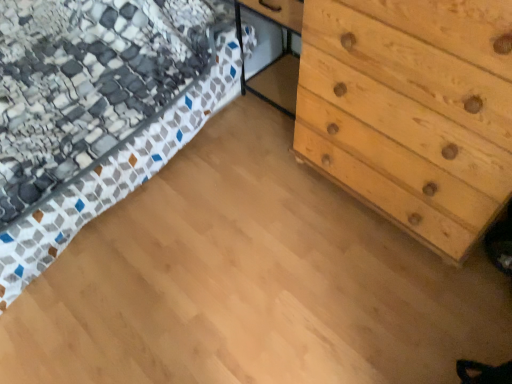
At what (x,y) coordinates should I click in order to perform the action: click on patterned fabric bed at upper left. Please return your answer as a coordinate pair (x, y). This screenshot has width=512, height=384. Looking at the image, I should click on (105, 104).

What do you see at coordinates (105, 104) in the screenshot? I see `patterned fabric bed at upper left` at bounding box center [105, 104].

Image resolution: width=512 pixels, height=384 pixels. What do you see at coordinates (401, 122) in the screenshot?
I see `natural wood chest of drawers at right` at bounding box center [401, 122].

Find the location of a particular element. The width and height of the screenshot is (512, 384). natural wood chest of drawers at right is located at coordinates (401, 122).

In order to face natural wood chest of drawers at right, should I rotate leftwards or rightwards?

You should look right and rotate roughly 22.495 degrees.

The width and height of the screenshot is (512, 384). Find the location of `patterned fabric bed at upper left`. patterned fabric bed at upper left is located at coordinates (105, 104).

Considering the relative positions of patterned fabric bed at upper left and natural wood chest of drawers at right in the image provided, is patterned fabric bed at upper left to the left or to the right of natural wood chest of drawers at right?

Based on their positions, patterned fabric bed at upper left is located to the left of natural wood chest of drawers at right.

Consider the image. Is patterned fabric bed at upper left behind natural wood chest of drawers at right?

Yes, it is.

Does point (205, 112) come in front of point (357, 79)?

No, (205, 112) is behind (357, 79).

From the image's perspective, is patterned fabric bed at upper left over natural wood chest of drawers at right?

Yes, from the image's perspective, patterned fabric bed at upper left is over natural wood chest of drawers at right.

From a real-world perspective, who is located lower, patterned fabric bed at upper left or natural wood chest of drawers at right?

patterned fabric bed at upper left, from a real-world perspective.

Can you confirm if patterned fabric bed at upper left is wider than natural wood chest of drawers at right?

Yes.

Between patterned fabric bed at upper left and natural wood chest of drawers at right, which one has more height?

natural wood chest of drawers at right is taller.

Which of these two, patterned fabric bed at upper left or natural wood chest of drawers at right, is smaller?

natural wood chest of drawers at right is smaller.

Which is correct: patterned fabric bed at upper left is inside natural wood chest of drawers at right, or outside of it?

patterned fabric bed at upper left is outside natural wood chest of drawers at right.

Would you say patterned fabric bed at upper left is a long distance from natural wood chest of drawers at right?

No, patterned fabric bed at upper left is in close proximity to natural wood chest of drawers at right.

Is patterned fabric bed at upper left oriented away from natural wood chest of drawers at right?

That's not correct — patterned fabric bed at upper left is not looking away from natural wood chest of drawers at right.

The image size is (512, 384). Identify the location of bed above the natural wood chest of drawers at right (from the image's perspective). (105, 104).

Would you say natural wood chest of drawers at right is to the left or to the right of patterned fabric bed at upper left in the picture?

Based on their positions, natural wood chest of drawers at right is located to the right of patterned fabric bed at upper left.

Is natural wood chest of drawers at right in front of or behind patterned fabric bed at upper left in the image?

natural wood chest of drawers at right is positioned closer to the viewer than patterned fabric bed at upper left.

Considering the points (369, 151) and (145, 66), which point is behind, point (369, 151) or point (145, 66)?

The point (145, 66) is farther from the camera.

From the image's perspective, is natural wood chest of drawers at right on patterned fabric bed at upper left?

No, from the image's perspective, natural wood chest of drawers at right is not over patterned fabric bed at upper left.

From a real-world perspective, is natural wood chest of drawers at right positioned above or below patterned fabric bed at upper left?

From a real-world perspective, natural wood chest of drawers at right is physically above patterned fabric bed at upper left.

Considering the relative sizes of natural wood chest of drawers at right and patterned fabric bed at upper left in the image provided, is natural wood chest of drawers at right thinner than patterned fabric bed at upper left?

Yes, natural wood chest of drawers at right is thinner than patterned fabric bed at upper left.

Considering the sizes of objects natural wood chest of drawers at right and patterned fabric bed at upper left in the image provided, who is taller, natural wood chest of drawers at right or patterned fabric bed at upper left?

With more height is natural wood chest of drawers at right.

Considering the relative sizes of natural wood chest of drawers at right and patterned fabric bed at upper left in the image provided, is natural wood chest of drawers at right bigger than patterned fabric bed at upper left?

Incorrect, natural wood chest of drawers at right is not larger than patterned fabric bed at upper left.

Can patterned fabric bed at upper left be found inside natural wood chest of drawers at right?

No, patterned fabric bed at upper left is not inside natural wood chest of drawers at right.

Is natural wood chest of drawers at right beside patterned fabric bed at upper left?

natural wood chest of drawers at right is not next to patterned fabric bed at upper left, and they're not touching.

Based on the photo, is natural wood chest of drawers at right facing towards patterned fabric bed at upper left?

No, natural wood chest of drawers at right is not facing towards patterned fabric bed at upper left.

Based on the photo, can you tell me how much natural wood chest of drawers at right and patterned fabric bed at upper left differ in facing direction?

They differ by 0.296 degrees in their facing directions.

Locate an element on the screen. The height and width of the screenshot is (384, 512). bed behind the natural wood chest of drawers at right is located at coordinates tap(105, 104).

Image resolution: width=512 pixels, height=384 pixels. In order to click on bed located on the left of natural wood chest of drawers at right in this screenshot , I will do `click(105, 104)`.

At what (x,y) coordinates should I click in order to perform the action: click on bed above the natural wood chest of drawers at right (from the image's perspective). Please return your answer as a coordinate pair (x, y). Looking at the image, I should click on (105, 104).